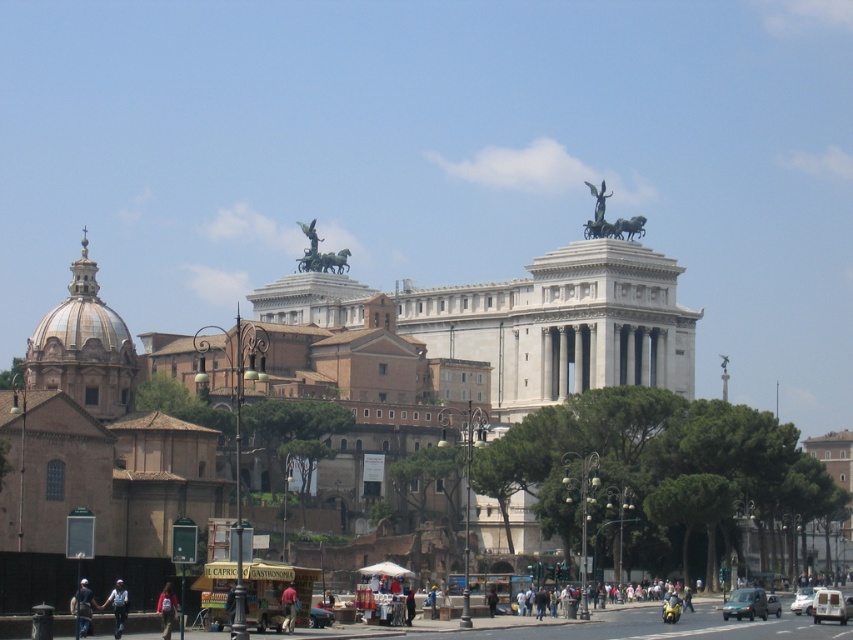
You are a delivery person carrying a thin package that is 10 cm wide. You see the polished bronze statue at upper center and the light brown leather jacket at lower center in the scene. Which object can the package fit through if placed between them?

The thin package can fit through the space between the polished bronze statue at upper center and the light brown leather jacket at lower center because the statue is thinner than the jacket, providing enough width for the package to pass through.

Consider the image. You are a photographer standing on the sidewalk in the scene. You want to capture both the polished bronze statue at upper center and the light brown leather jacket at lower center in a single photo. Considering their sizes, which object will appear larger in the photo?

The polished bronze statue at upper center will appear larger in the photo because it is much taller than the light brown leather jacket at lower center.

You are a photographer standing in the middle of the street. You want to capture both the light blue jeans at lower left and the bronze statue at upper center in one frame. Which object should you focus on to ensure both are visible without zooming in or out?

To ensure both the light blue jeans at lower left and the bronze statue at upper center are visible without zooming, focus on the bronze statue at upper center since the light blue jeans at lower left is wider and might require a wider angle to include both.